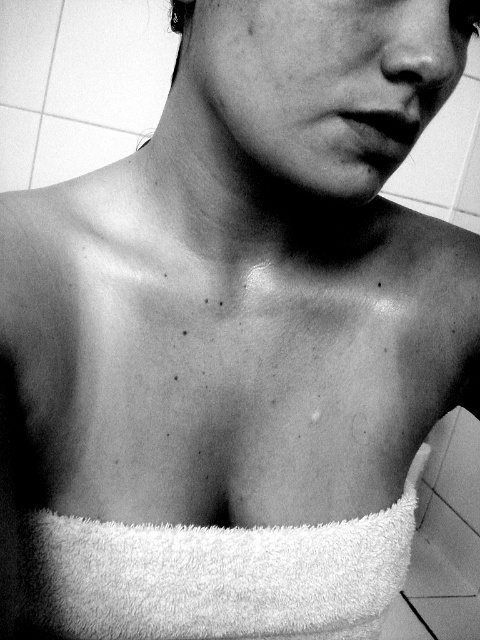
Does white fluffy towel at center appear under smooth skin at center?

Yes, white fluffy towel at center is below smooth skin at center.

Between point (37, 520) and point (433, 17), which one is positioned behind?

Positioned behind is point (37, 520).

Is point (72, 561) farther from viewer compared to point (238, 72)?

Yes.

In order to click on white fluffy towel at center in this screenshot , I will do point(217,577).